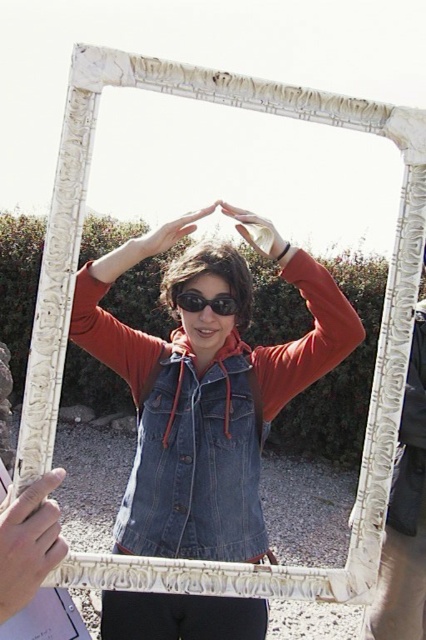
Question: Which point is closer to the camera?

Choices:
 (A) white carved frame at center
 (B) faded denim jacket at center

Answer: (B)

Question: Does denim jacket at center have a smaller size compared to faded denim jacket at center?

Choices:
 (A) yes
 (B) no

Answer: (B)

Question: Which object appears closest to the camera in this image?

Choices:
 (A) denim jacket at center
 (B) faded denim jacket at center
 (C) black plastic goggles at center
 (D) white carved frame at center

Answer: (A)

Question: Based on their relative distances, which object is farther from the black plastic goggles at center?

Choices:
 (A) denim jacket at center
 (B) white carved frame at center

Answer: (B)

Question: From the image, what is the correct spatial relationship of denim jacket at center in relation to faded denim jacket at center?

Choices:
 (A) left
 (B) right

Answer: (B)

Question: In this image, where is denim jacket at center located relative to white carved frame at center?

Choices:
 (A) right
 (B) left

Answer: (B)